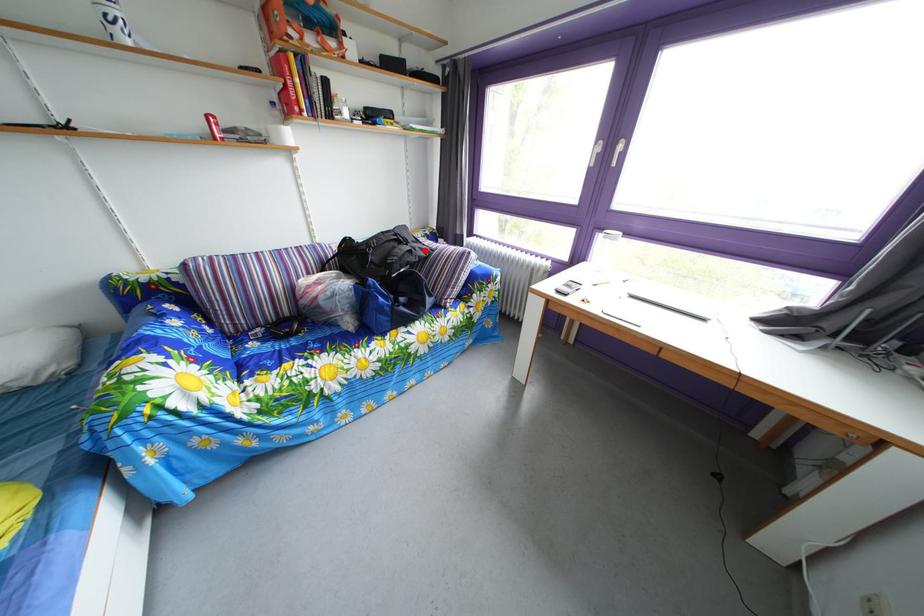
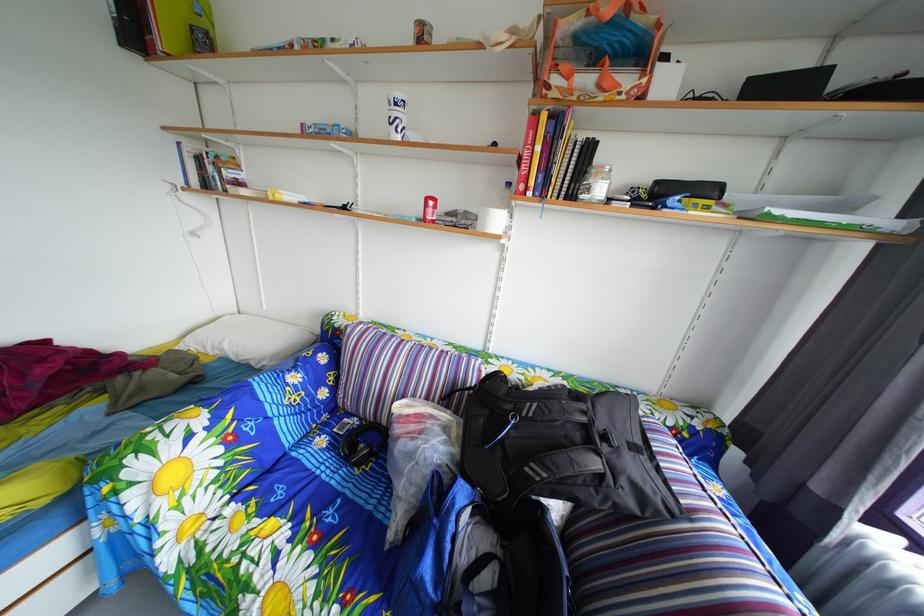
Question: A red point is marked in image1. In image2, is the corresponding 3D point closer to the camera or farther? Reply with the corresponding letter.

Choices:
 (A) The corresponding 3D point is closer.
 (B) The corresponding 3D point is farther.

Answer: (B)